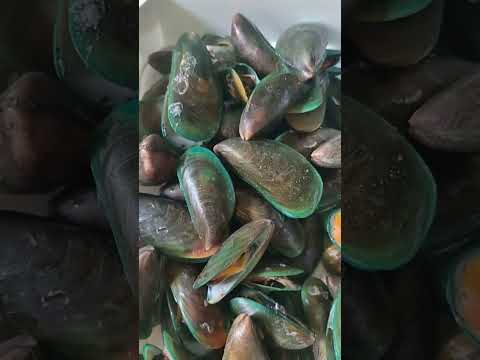
This screenshot has height=360, width=480. Identify the location of right bar. (440, 196).